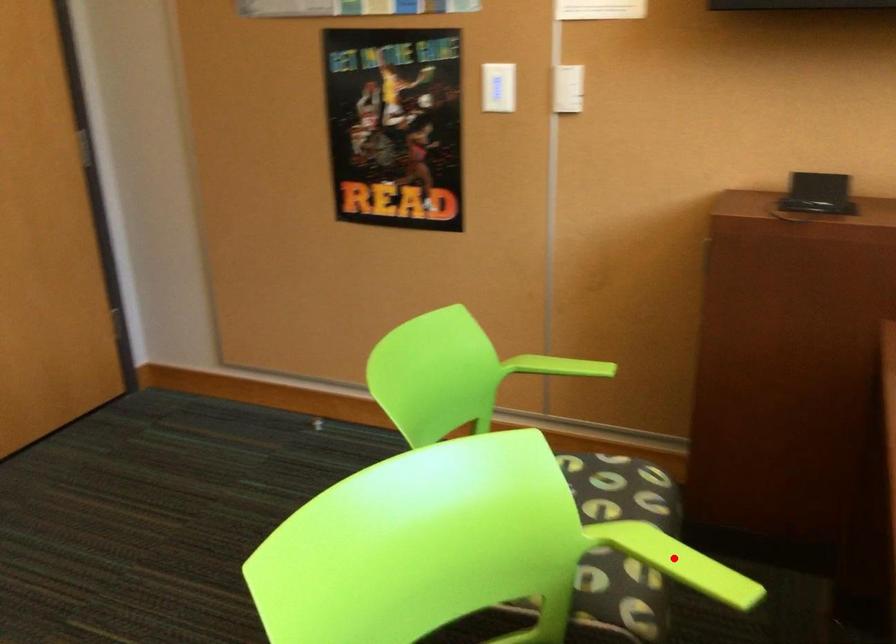
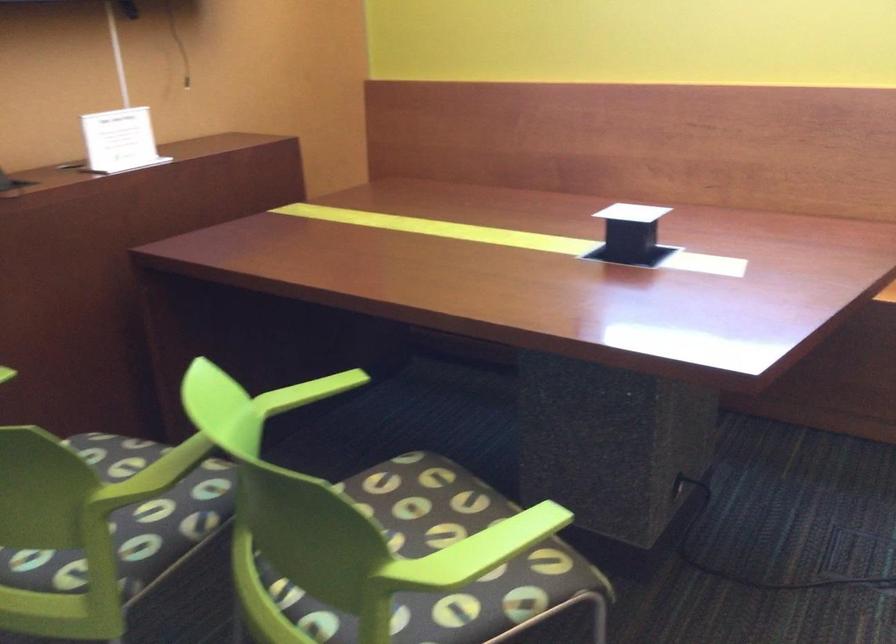
Question: I am providing you with two images of the same scene from different viewpoints. A red point is shown in image1. For the corresponding object point in image2, is it positioned nearer or farther from the camera?

Choices:
 (A) Nearer
 (B) Farther

Answer: (B)